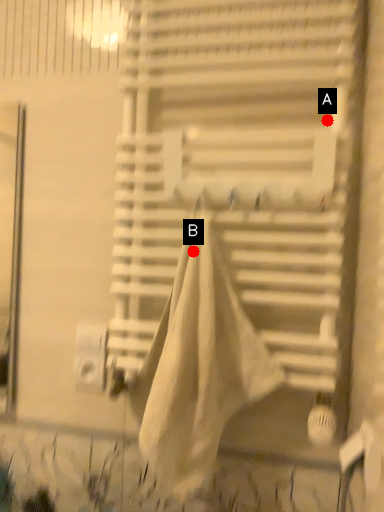
Question: Two points are circled on the image, labeled by A and B beside each circle. Which point appears farthest from the camera in this image?

Choices:
 (A) A is further
 (B) B is further

Answer: (A)